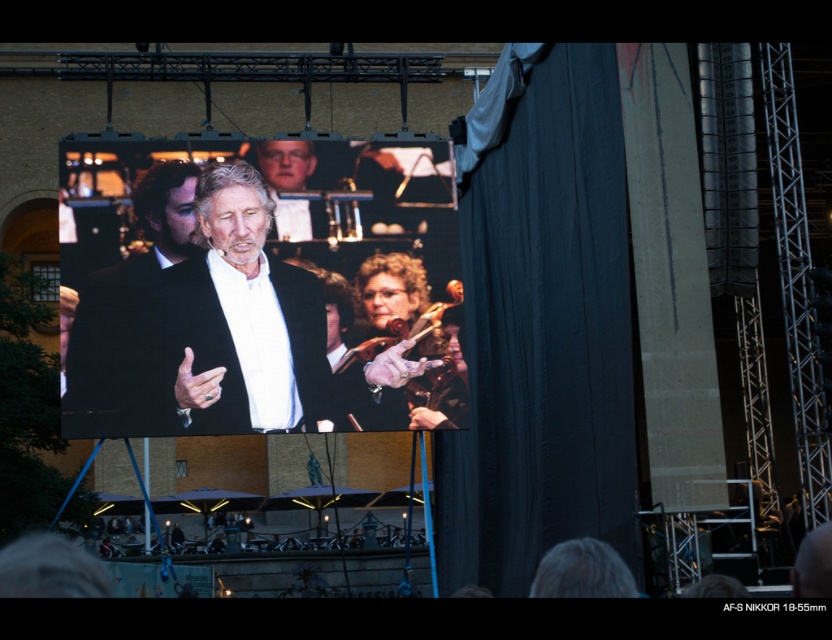
Question: Estimate the real-world distances between objects in this image. Which object is farther from the black matte suit at left?

Choices:
 (A) dark fabric curtain at right
 (B) shiny gold violin at center
 (C) matte black hand at center

Answer: (A)

Question: Is matte black suit at center to the right of shiny gold violin at center from the viewer's perspective?

Choices:
 (A) no
 (B) yes

Answer: (A)

Question: Among these objects, which one is farthest from the camera?

Choices:
 (A) dark fabric curtain at right
 (B) smooth skin hand at center
 (C) matte black hand at center
 (D) black matte suit at left

Answer: (C)

Question: Is dark fabric curtain at right bigger than smooth skin hand at center?

Choices:
 (A) no
 (B) yes

Answer: (B)

Question: Is black matte suit at left thinner than leather glove at center?

Choices:
 (A) no
 (B) yes

Answer: (B)

Question: Considering the real-world distances, which object is closest to the dark fabric curtain at right?

Choices:
 (A) matte black hand at center
 (B) leather glove at center
 (C) matte black suit at center

Answer: (A)